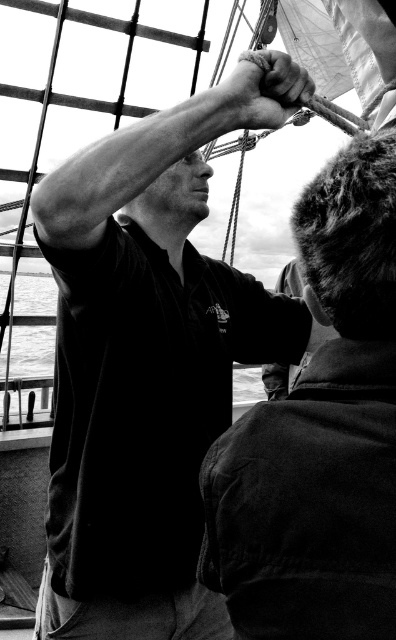
You are a sailor on the ship and need to reach the smooth metal hand at center to secure the sail. There is a dark fabric jacket at center in your way. Is the jacket blocking your path to the hand?

The dark fabric jacket at center is below the smooth metal hand at center, so the jacket is not blocking the path to the hand.

Based on the scene described, which object takes up more area in the image between the dark fabric jacket at center and the smooth water at center?

The smooth water at center occupies more area than the dark fabric jacket at center in the image.

You are on a ship and need to determine which object is lower in height between the dark fabric jacket at center and the smooth water at center. Based on the scene described, which one is lower?

The dark fabric jacket at center has a lesser height compared to the smooth water at center, so the dark fabric jacket at center is lower.